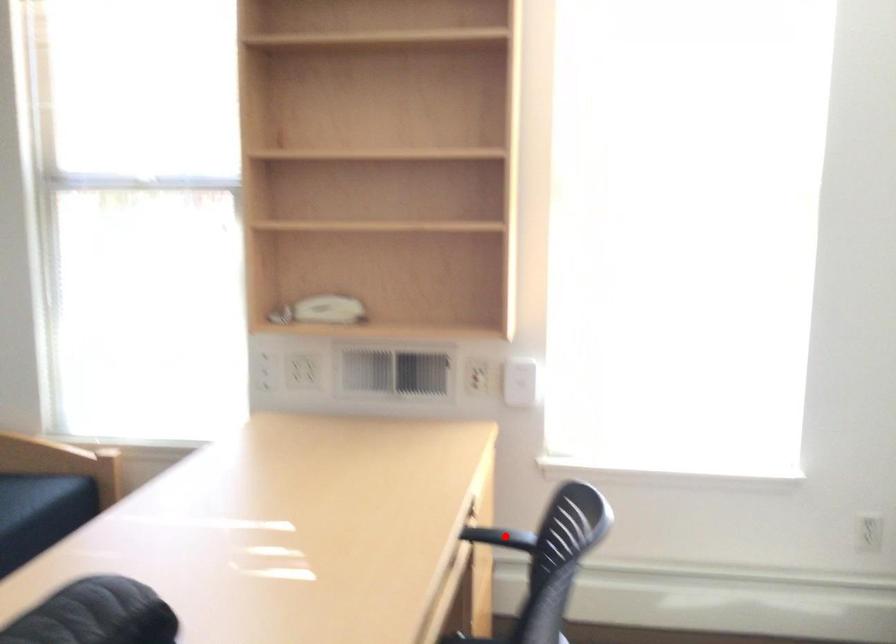
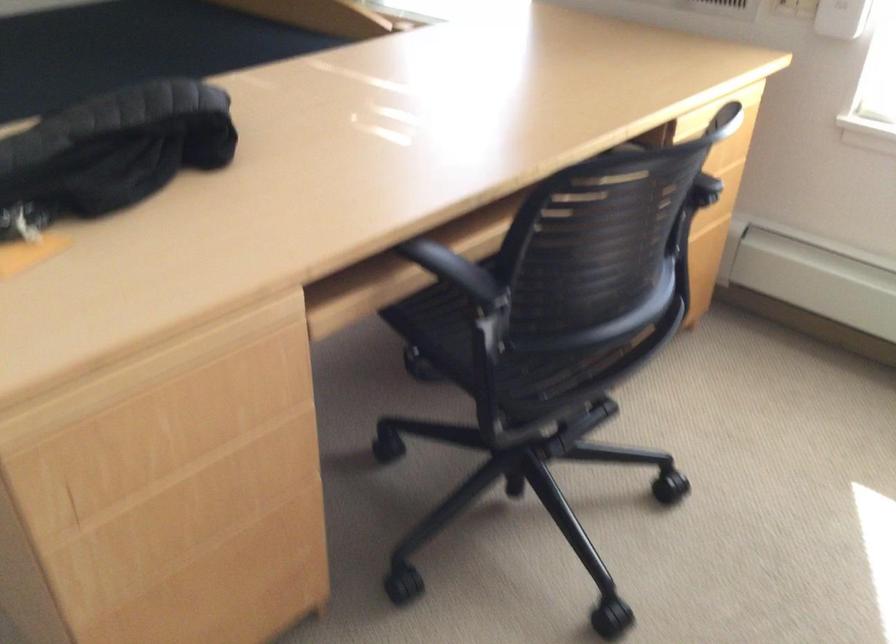
Question: I am providing you with two images of the same scene from different viewpoints. A red point is marked on the first image. Is the red point's position out of view in image 2?

Choices:
 (A) Yes
 (B) No

Answer: (A)